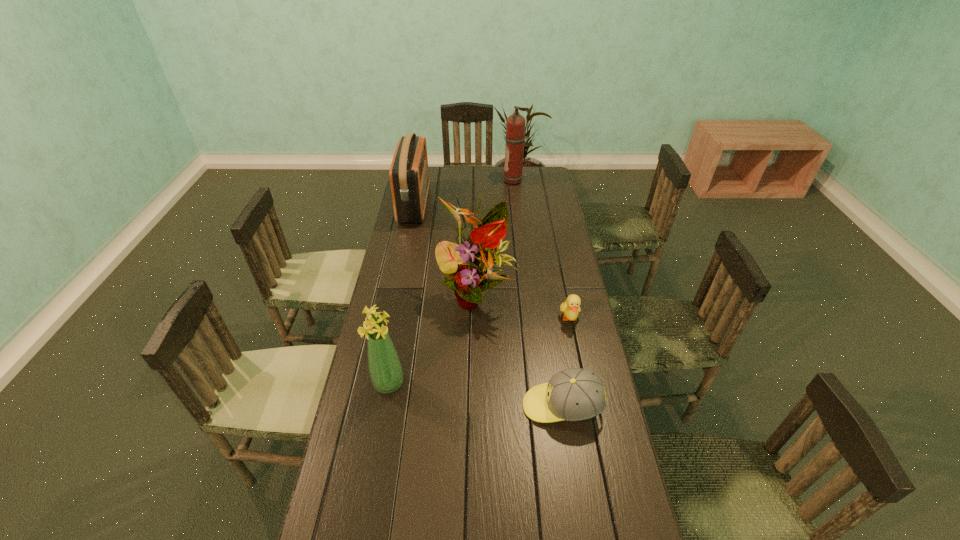
At what (x,y) coordinates should I click in order to perform the action: click on vacant space that's between the duckling and the nearer bouquet. Please return your answer as a coordinate pair (x, y). Looking at the image, I should click on (479, 351).

Where is `vacant space that's between the radio receiver and the baseball cap`? The height and width of the screenshot is (540, 960). vacant space that's between the radio receiver and the baseball cap is located at coordinates (489, 305).

Find the location of a particular element. The image size is (960, 540). free point between the baseball cap and the radio receiver is located at coordinates (489, 305).

Identify the location of object that ranks as the second closest to the duckling. (575, 394).

Point out which object is positioned as the fourth nearest to the radio receiver. Please provide its 2D coordinates. Your answer should be formatted as a tuple, i.e. [(x, y)], where the tuple contains the x and y coordinates of a point satisfying the conditions above.

[(385, 369)]

I want to click on vacant area that satisfies the following two spatial constraints: 1. on the front-facing side of the duckling; 2. on the front-facing side of the baseball cap, so click(x=588, y=406).

You are a GUI agent. You are given a task and a screenshot of the screen. Output one action in this format:
    pyautogui.click(x=<x>, y=<y>)
    Task: Click on the free spot that satisfies the following two spatial constraints: 1. on the front-facing side of the duckling; 2. on the front-facing side of the left bouquet
    The width and height of the screenshot is (960, 540).
    Given the screenshot: What is the action you would take?
    pyautogui.click(x=583, y=383)